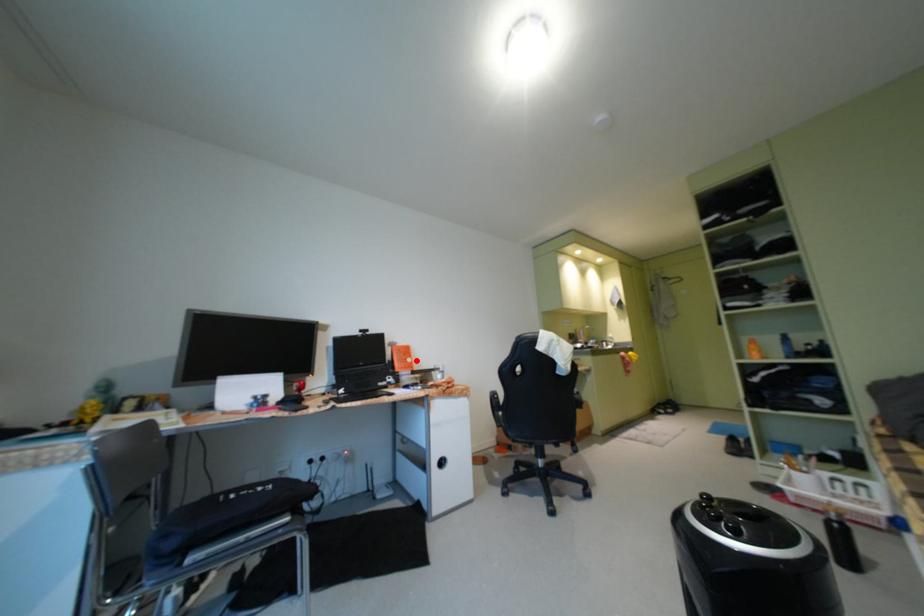
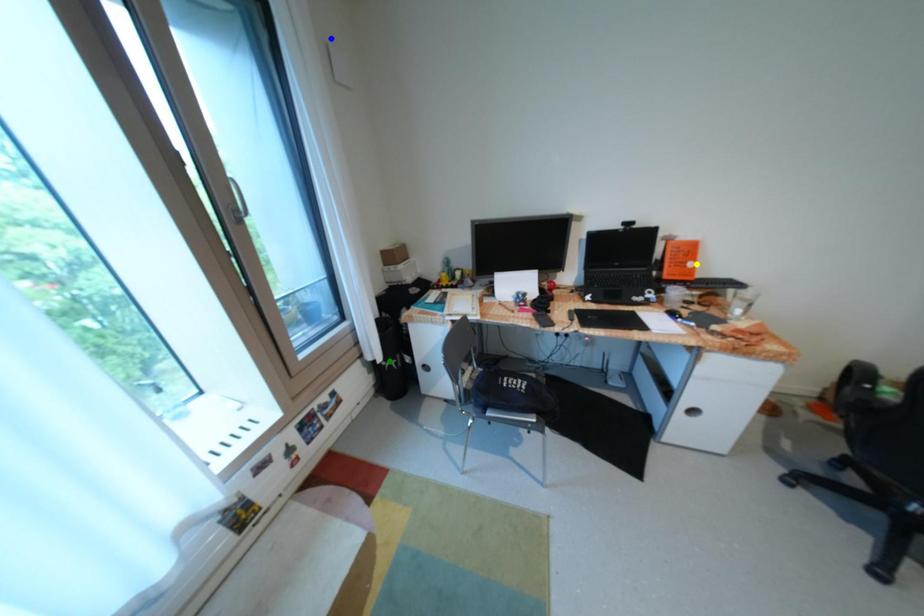
Question: I am providing you with two images of the same scene from different viewpoints. A red point is marked on the first image. You are given multiple points on the second image. Which spot in image 2 lines up with the point in image 1?

Choices:
 (A) green point
 (B) blue point
 (C) yellow point

Answer: (C)